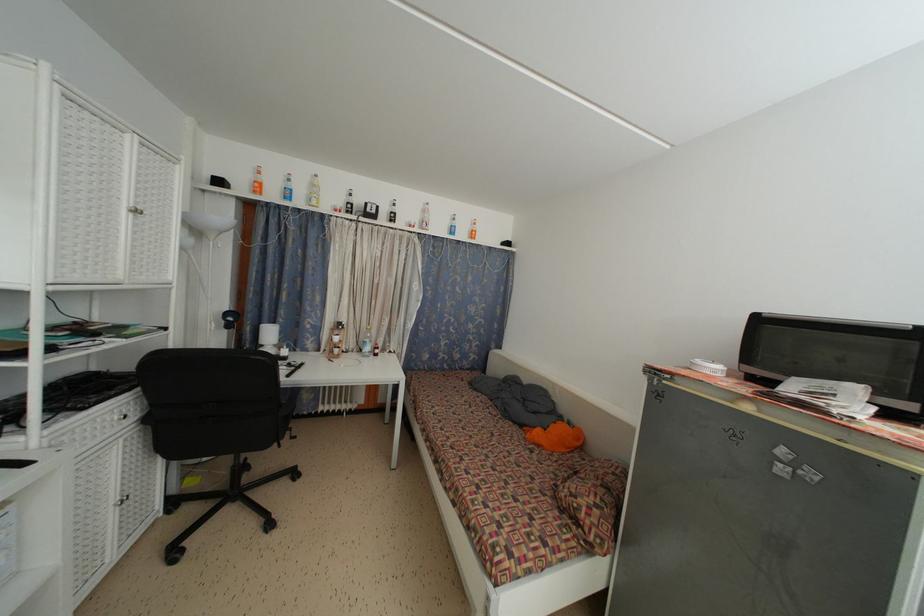
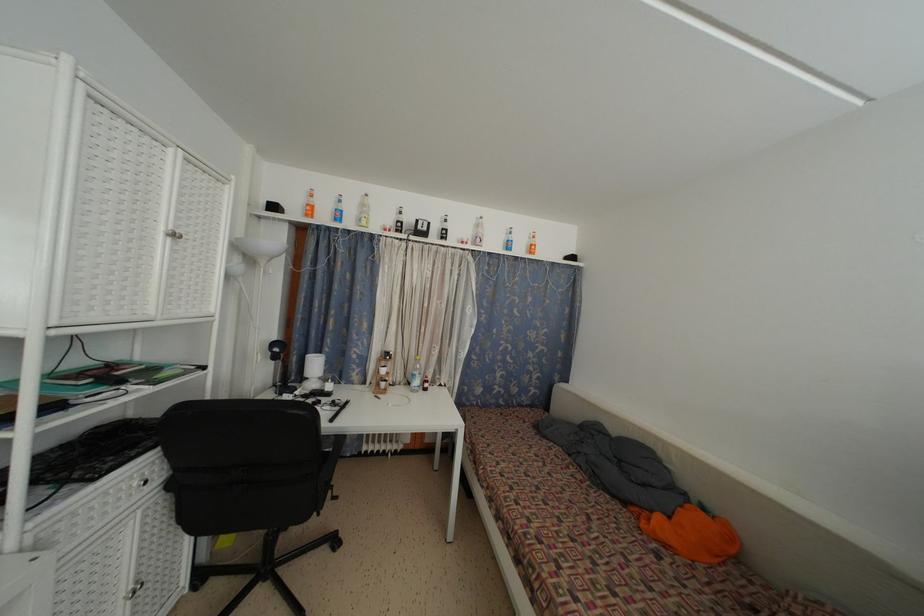
Where in the second image is the point corresponding to point (395, 217) from the first image?

(446, 235)